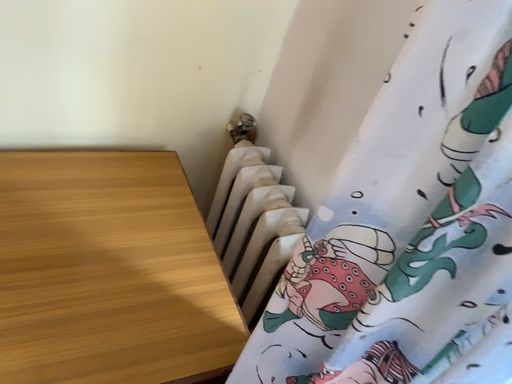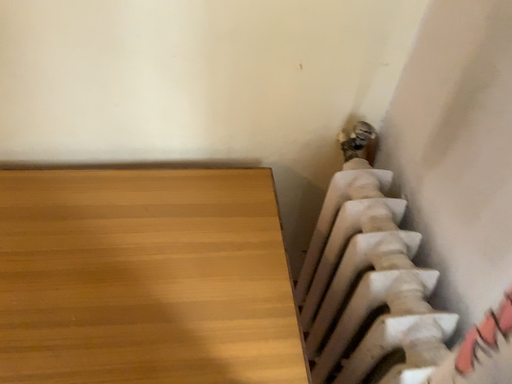
Question: How did the camera likely rotate when shooting the video?

Choices:
 (A) rotated left
 (B) rotated right

Answer: (A)